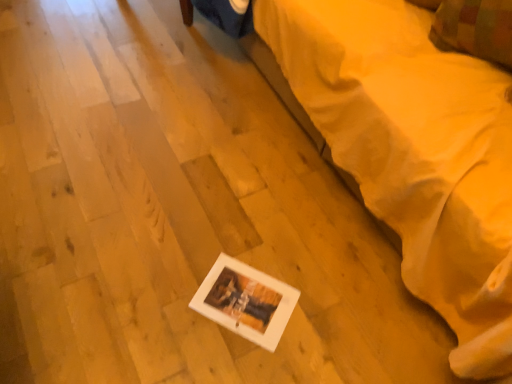
Where is `plaid fabric pillow at upper right`? The image size is (512, 384). plaid fabric pillow at upper right is located at coordinates (475, 29).

The image size is (512, 384). What do you see at coordinates (475, 29) in the screenshot?
I see `plaid fabric pillow at upper right` at bounding box center [475, 29].

Locate an element on the screen. white matte picture frame at lower center is located at coordinates (414, 152).

The width and height of the screenshot is (512, 384). What do you see at coordinates (414, 152) in the screenshot?
I see `white matte picture frame at lower center` at bounding box center [414, 152].

Where is `plaid fabric pillow at upper right`? This screenshot has height=384, width=512. plaid fabric pillow at upper right is located at coordinates (475, 29).

Considering the positions of objects plaid fabric pillow at upper right and white matte picture frame at lower center in the image provided, who is more to the right, plaid fabric pillow at upper right or white matte picture frame at lower center?

plaid fabric pillow at upper right.

Is plaid fabric pillow at upper right further to camera compared to white matte picture frame at lower center?

Yes, it is behind white matte picture frame at lower center.

Considering the points (449, 26) and (426, 101), which point is in front, point (449, 26) or point (426, 101)?

The point (426, 101) is in front.

From the image's perspective, does plaid fabric pillow at upper right appear lower than white matte picture frame at lower center?

No, from the image's perspective, plaid fabric pillow at upper right is not beneath white matte picture frame at lower center.

From a real-world perspective, who is located higher, plaid fabric pillow at upper right or white matte picture frame at lower center?

plaid fabric pillow at upper right.

Is plaid fabric pillow at upper right thinner than white matte picture frame at lower center?

Yes.

Which of these two, plaid fabric pillow at upper right or white matte picture frame at lower center, stands shorter?

plaid fabric pillow at upper right is shorter.

Is plaid fabric pillow at upper right smaller than white matte picture frame at lower center?

Yes, plaid fabric pillow at upper right is smaller than white matte picture frame at lower center.

Consider the image. Would you say plaid fabric pillow at upper right is outside white matte picture frame at lower center?

That's incorrect, plaid fabric pillow at upper right is not completely outside white matte picture frame at lower center.

Is plaid fabric pillow at upper right directly adjacent to white matte picture frame at lower center?

They are not placed beside each other.

Is plaid fabric pillow at upper right facing away from white matte picture frame at lower center?

Correct, plaid fabric pillow at upper right is looking away from white matte picture frame at lower center.

What's the angular difference between plaid fabric pillow at upper right and white matte picture frame at lower center's facing directions?

25.2 degrees.

How much distance is there between plaid fabric pillow at upper right and white matte picture frame at lower center?

plaid fabric pillow at upper right is 32.57 centimeters from white matte picture frame at lower center.

Where is `pillow above the white matte picture frame at lower center (from a real-world perspective)`? The image size is (512, 384). pillow above the white matte picture frame at lower center (from a real-world perspective) is located at coordinates (475, 29).

Does white matte picture frame at lower center appear on the left side of plaid fabric pillow at upper right?

Correct, you'll find white matte picture frame at lower center to the left of plaid fabric pillow at upper right.

Is white matte picture frame at lower center in front of or behind plaid fabric pillow at upper right in the image?

In the image, white matte picture frame at lower center appears in front of plaid fabric pillow at upper right.

Is point (455, 84) positioned behind point (470, 46)?

No, it is not.

From the image's perspective, which is above, white matte picture frame at lower center or plaid fabric pillow at upper right?

plaid fabric pillow at upper right.

From a real-world perspective, does white matte picture frame at lower center sit lower than plaid fabric pillow at upper right?

Indeed, from a real-world perspective, white matte picture frame at lower center is positioned beneath plaid fabric pillow at upper right.

Looking at this image, between white matte picture frame at lower center and plaid fabric pillow at upper right, which one has larger width?

white matte picture frame at lower center is wider.

Can you confirm if white matte picture frame at lower center is taller than plaid fabric pillow at upper right?

Indeed, white matte picture frame at lower center has a greater height compared to plaid fabric pillow at upper right.

Is white matte picture frame at lower center bigger than plaid fabric pillow at upper right?

Yes, white matte picture frame at lower center is bigger than plaid fabric pillow at upper right.

Would you say white matte picture frame at lower center is inside or outside plaid fabric pillow at upper right?

white matte picture frame at lower center is spatially situated outside plaid fabric pillow at upper right.

Are white matte picture frame at lower center and plaid fabric pillow at upper right located far from each other?

That's not correct — white matte picture frame at lower center is a little close to plaid fabric pillow at upper right.

Is white matte picture frame at lower center aimed at plaid fabric pillow at upper right?

Yes.

How different are the orientations of white matte picture frame at lower center and plaid fabric pillow at upper right in degrees?

The angle between the facing direction of white matte picture frame at lower center and the facing direction of plaid fabric pillow at upper right is 25.2 degrees.

This screenshot has height=384, width=512. I want to click on pillow above the white matte picture frame at lower center (from the image's perspective), so click(475, 29).

The width and height of the screenshot is (512, 384). I want to click on pillow that appears above the white matte picture frame at lower center (from a real-world perspective), so click(475, 29).

You are a GUI agent. You are given a task and a screenshot of the screen. Output one action in this format:
    pyautogui.click(x=<x>, y=<y>)
    Task: Click on the pillow lying on the right of white matte picture frame at lower center
    
    Given the screenshot: What is the action you would take?
    475,29